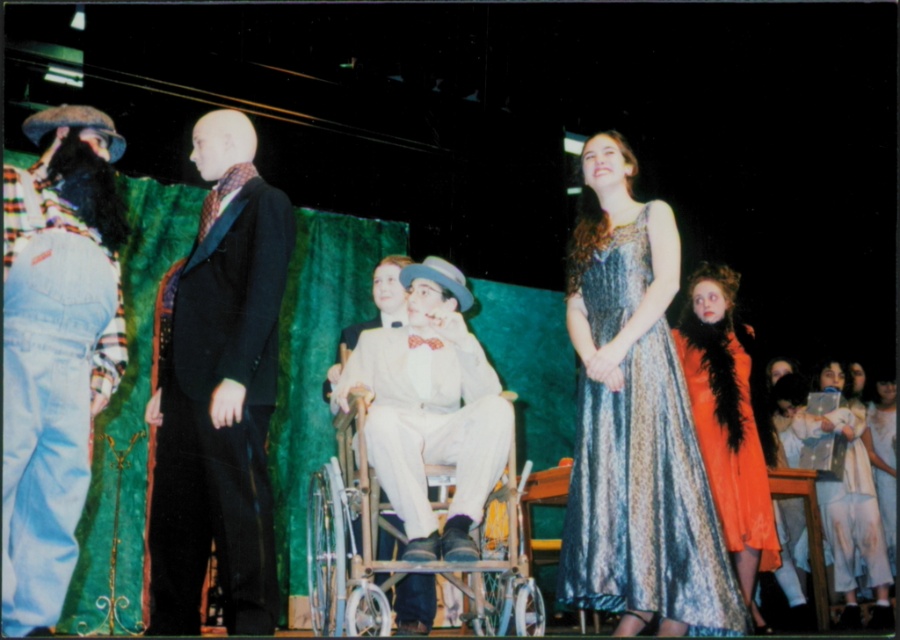
Question: Which object appears closest to the camera in this image?

Choices:
 (A) white lace dress at lower right
 (B) shiny metallic dress at center

Answer: (B)

Question: Which point appears closest to the camera in this image?

Choices:
 (A) (702, 413)
 (B) (487, 422)
 (C) (878, 593)

Answer: (B)

Question: Is shiny metallic dress at center behind white satin suit at center?

Choices:
 (A) yes
 (B) no

Answer: (B)

Question: Which object appears farthest from the camera in this image?

Choices:
 (A) denim jeans at left
 (B) shiny metallic dress at center
 (C) white satin suit at center

Answer: (C)

Question: From the image, what is the correct spatial relationship of denim jeans at left in relation to shiny orange dress at right?

Choices:
 (A) right
 (B) left

Answer: (B)

Question: Is denim jeans at left to the right of white lace dress at lower right from the viewer's perspective?

Choices:
 (A) yes
 (B) no

Answer: (B)